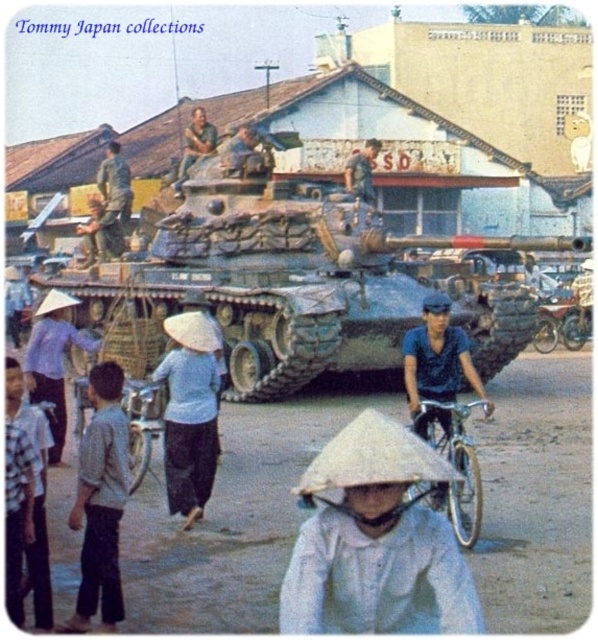
You are a photographer standing at the camera position. You want to take a closeup photo of the silver metallic bicycle at lower center. Can you estimate how far you need to walk forward to get the bicycle to fill the frame without zooming?

The silver metallic bicycle at lower center is 5.17 meters from the camera. To get a closeup without zooming, you would need to move closer to reduce the distance. However, the exact distance adjustment depends on your camera sensor size and lens focal length. Without specific equipment details, it is hard to calculate precisely, but moving closer to about 2 meters away might work for many standard cameras.

You are a photographer trying to capture a clear shot of both the white woven hat at lower center and the white cotton conical hat at center. Since you want both hats to be visible in your photo, which one should you focus on first to ensure the other remains in focus?

You should focus on the white cotton conical hat at center first because the white woven hat at lower center is in front of it. By focusing on the further object, the depth of field may allow both to be in focus.